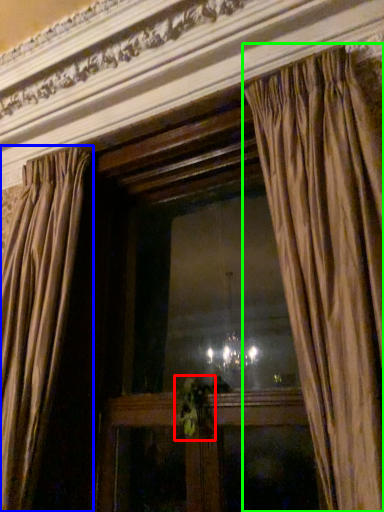
Question: Which object is positioned farthest from plant (highlighted by a red box)? Select from curtain (highlighted by a blue box) and curtain (highlighted by a green box).

Choices:
 (A) curtain
 (B) curtain

Answer: (B)